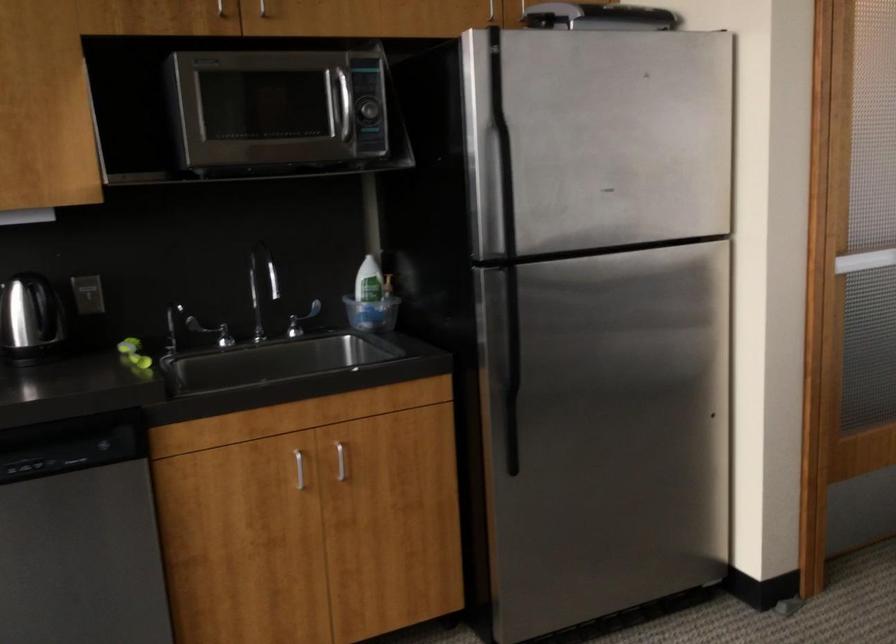
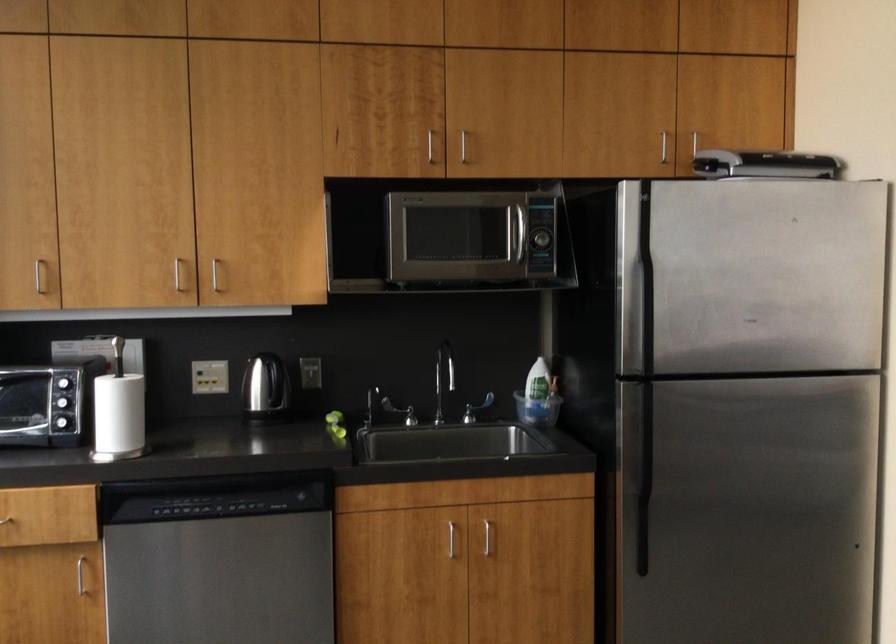
The point at (297, 468) is marked in the first image. Where is the corresponding point in the second image?

(450, 538)